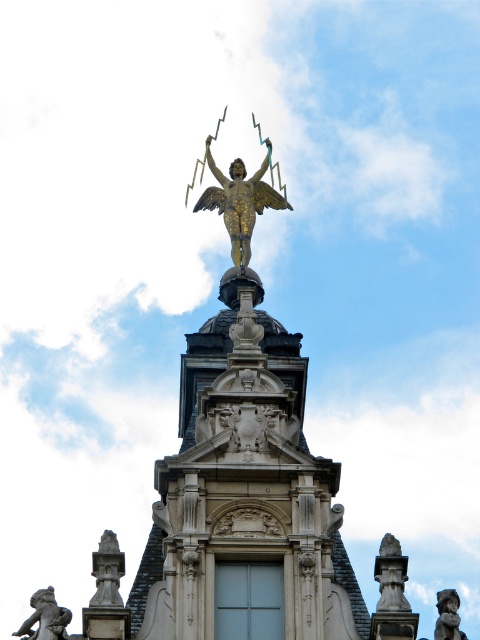
Question: Which object appears closest to the camera in this image?

Choices:
 (A) bronze statue at lower right
 (B) gold metallic statue at upper center

Answer: (A)

Question: Which object is the farthest from the bronze statue at lower right?

Choices:
 (A) gold metallic statue at upper center
 (B) bronze statue at lower left

Answer: (B)

Question: Can you confirm if gold metallic statue at upper center is bigger than bronze statue at lower right?

Choices:
 (A) no
 (B) yes

Answer: (A)

Question: Is gold metallic statue at upper center positioned before bronze statue at lower left?

Choices:
 (A) no
 (B) yes

Answer: (A)

Question: Among these objects, which one is nearest to the camera?

Choices:
 (A) gold metallic statue at upper center
 (B) bronze statue at lower right

Answer: (B)

Question: Is bronze statue at lower left positioned before bronze statue at lower right?

Choices:
 (A) yes
 (B) no

Answer: (B)